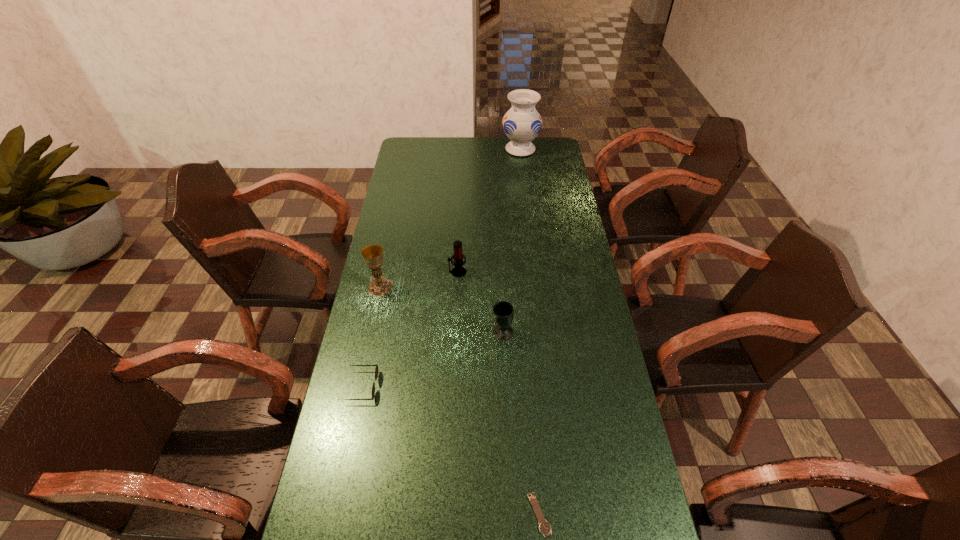
Where is `the tallest object`? the tallest object is located at coordinates (522, 123).

At what (x,y) coordinates should I click in order to perform the action: click on the farthest object. Please return your answer as a coordinate pair (x, y). The height and width of the screenshot is (540, 960). Looking at the image, I should click on (522, 123).

Locate an element on the screen. The width and height of the screenshot is (960, 540). the left chalice is located at coordinates (379, 286).

You are a GUI agent. You are given a task and a screenshot of the screen. Output one action in this format:
    pyautogui.click(x=<x>, y=<y>)
    Task: Click on the second tallest object
    The height and width of the screenshot is (540, 960).
    Given the screenshot: What is the action you would take?
    pyautogui.click(x=379, y=286)

Find the location of a particular element. the fourth object from right to left is located at coordinates (458, 271).

This screenshot has height=540, width=960. Find the location of `the second farthest object`. the second farthest object is located at coordinates (458, 271).

This screenshot has width=960, height=540. In order to click on the nearer chalice in this screenshot , I will do `click(503, 313)`.

Where is `the shorter chalice`? The width and height of the screenshot is (960, 540). the shorter chalice is located at coordinates (503, 313).

Identify the location of the second nearest object. This screenshot has width=960, height=540. (376, 370).

Find the location of a particular element. Image resolution: width=960 pixels, height=540 pixels. the fifth tallest object is located at coordinates (376, 370).